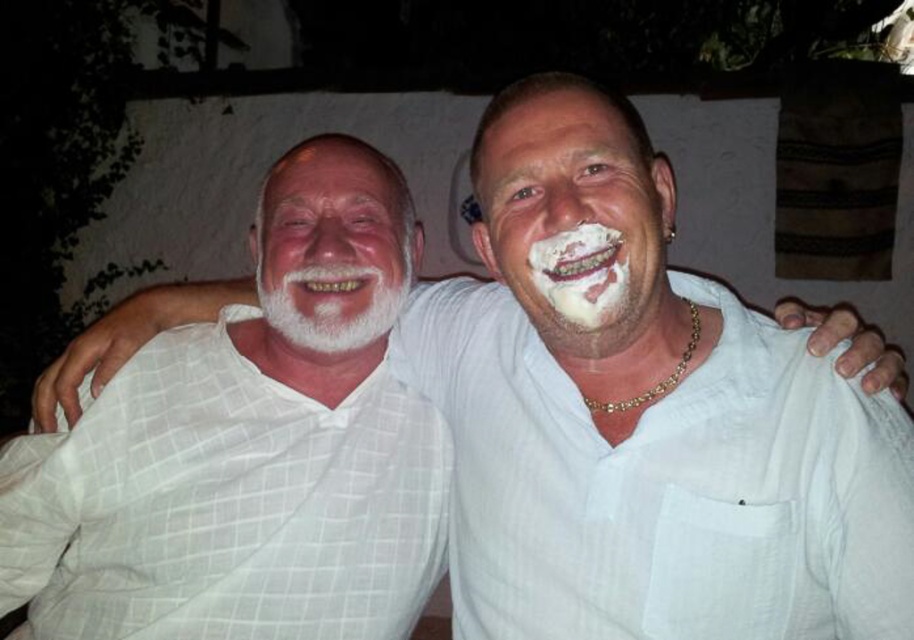
Between point (293, 616) and point (339, 280), which one is positioned behind?

Positioned behind is point (339, 280).

Between white checkered shirt at left and white matte beard at left, which one has less height?

white matte beard at left is shorter.

The height and width of the screenshot is (640, 914). Identify the location of white checkered shirt at left. (225, 506).

Does white matte beard at left have a smaller size compared to white soft beard at center?

Incorrect, white matte beard at left is not smaller in size than white soft beard at center.

Does white matte beard at left come behind white soft beard at center?

No, white matte beard at left is in front of white soft beard at center.

Locate an element on the screen. The image size is (914, 640). white matte beard at left is located at coordinates (333, 246).

You are a GUI agent. You are given a task and a screenshot of the screen. Output one action in this format:
    pyautogui.click(x=<x>, y=<y>)
    Task: Click on the white matte beard at left
    This screenshot has width=914, height=640.
    Given the screenshot: What is the action you would take?
    pyautogui.click(x=333, y=246)

Is white matte beard at left wider than white creamy shaving cream at mouth?

Indeed, white matte beard at left has a greater width compared to white creamy shaving cream at mouth.

Looking at this image, can you confirm if white matte beard at left is positioned to the left of white creamy shaving cream at mouth?

Indeed, white matte beard at left is positioned on the left side of white creamy shaving cream at mouth.

Between point (360, 161) and point (545, 269), which one is positioned in front?

Point (545, 269) is in front.

Where is `white matte beard at left`? Image resolution: width=914 pixels, height=640 pixels. white matte beard at left is located at coordinates (333, 246).